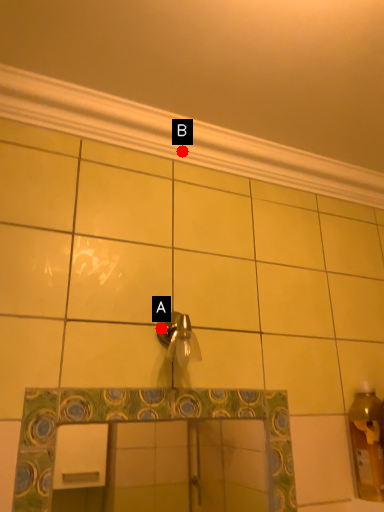
Question: Two points are circled on the image, labeled by A and B beside each circle. Which point is farther from the camera taking this photo?

Choices:
 (A) A is further
 (B) B is further

Answer: (B)